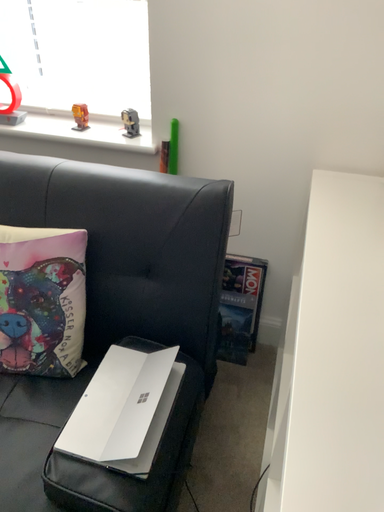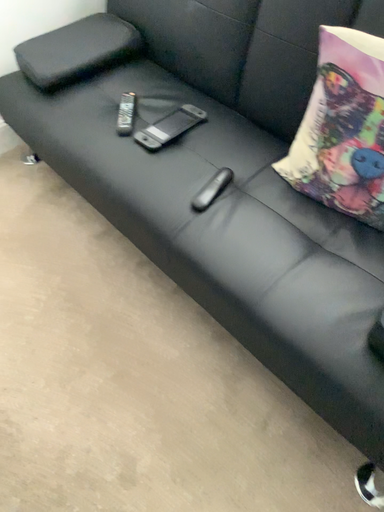
Question: How did the camera likely rotate when shooting the video?

Choices:
 (A) rotated downward
 (B) rotated upward

Answer: (A)